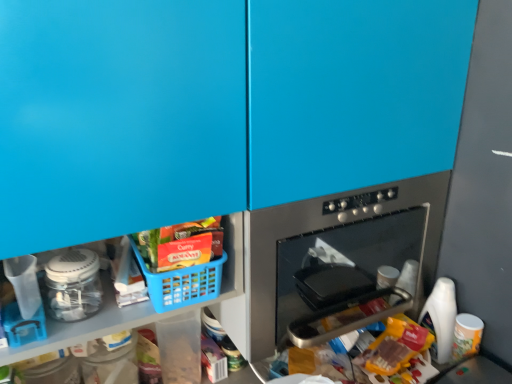
Question: Would you say translucent plastic bag at lower center, acting as the first food starting from the right, is inside or outside white plastic bottle at lower right?

Choices:
 (A) inside
 (B) outside

Answer: (B)

Question: Considering the positions of point (379, 334) and point (437, 279), is point (379, 334) closer or farther from the camera than point (437, 279)?

Choices:
 (A) farther
 (B) closer

Answer: (B)

Question: Estimate the real-world distances between objects in this image. Which object is farther from the white plastic bottle at lower right?

Choices:
 (A) translucent plastic bag at lower center, arranged as the first food when ordered from the bottom
 (B) blue plastic basket at lower left
 (C) matte plastic basket at lower center, positioned as the first food in top-to-bottom order
 (D) clear plastic jar at lower left
 (E) stainless steel oven at center

Answer: (D)

Question: Which object is the closest to the stainless steel oven at center?

Choices:
 (A) clear plastic jar at lower left
 (B) white plastic bottle at lower right
 (C) matte plastic basket at lower center, placed as the second food when sorted from right to left
 (D) blue plastic basket at lower left
 (E) translucent plastic bag at lower center, the 2th food viewed from the left

Answer: (E)